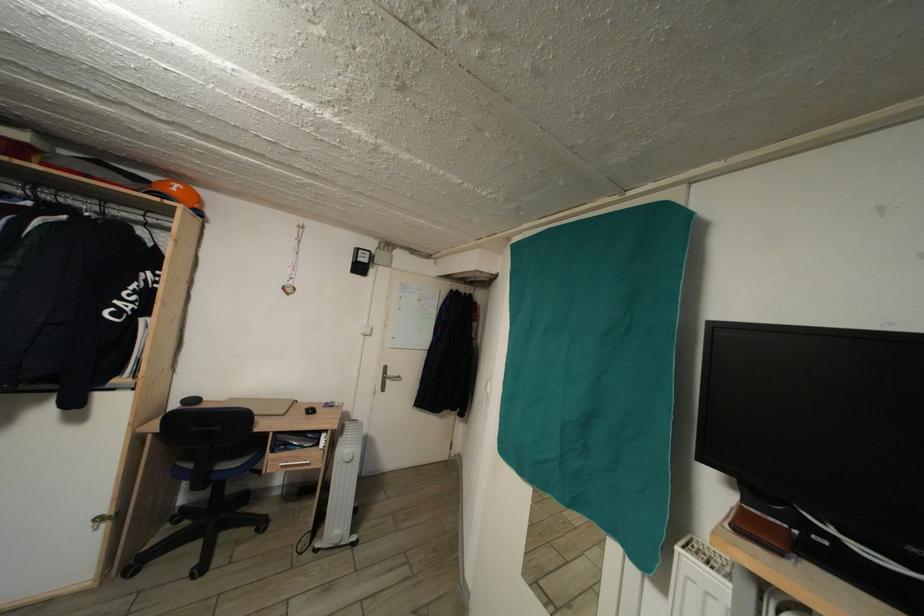
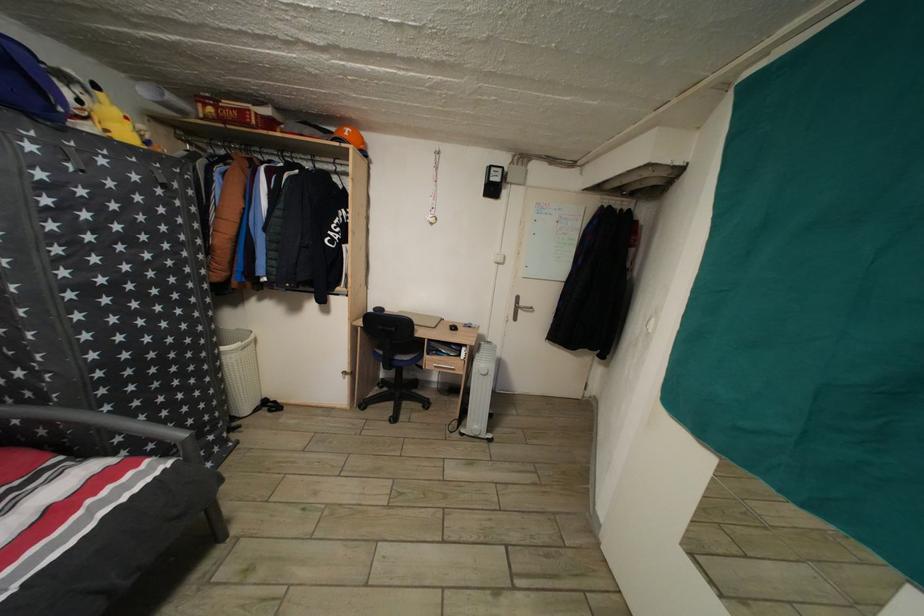
The point at (292, 456) is marked in the first image. Where is the corresponding point in the second image?

(443, 361)